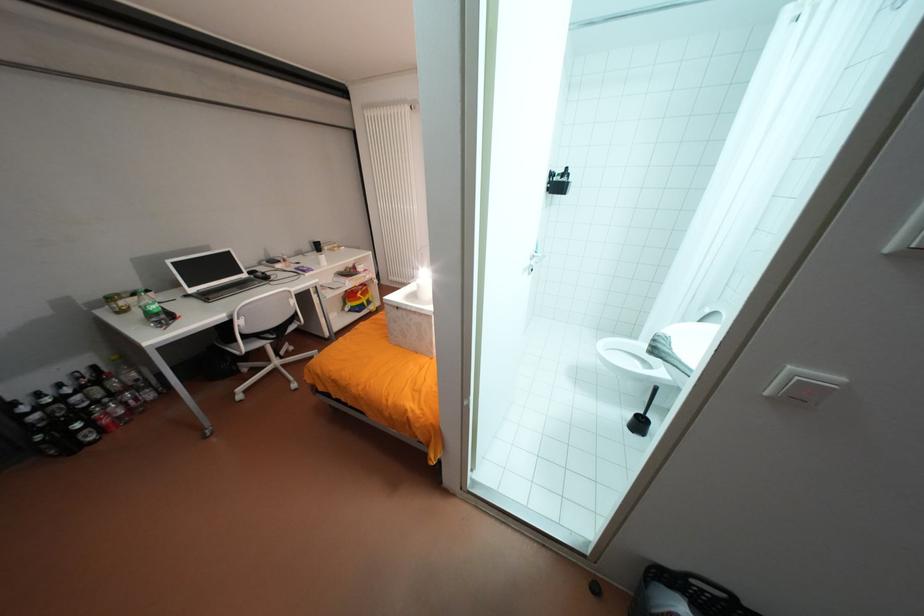
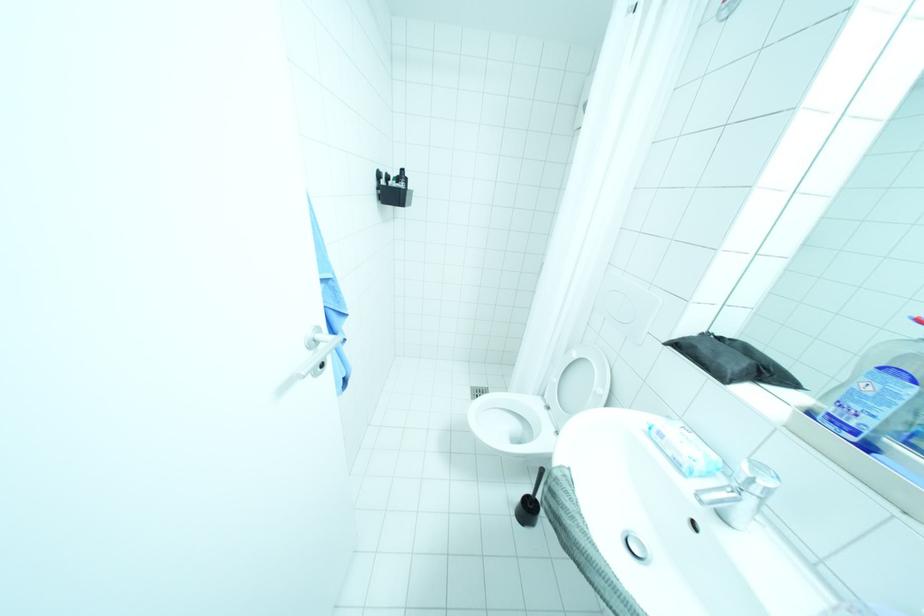
Question: The images are taken continuously from a first-person perspective. In which direction is your viewpoint rotating?

Choices:
 (A) Left
 (B) Right
 (C) Up
 (D) Down

Answer: (B)